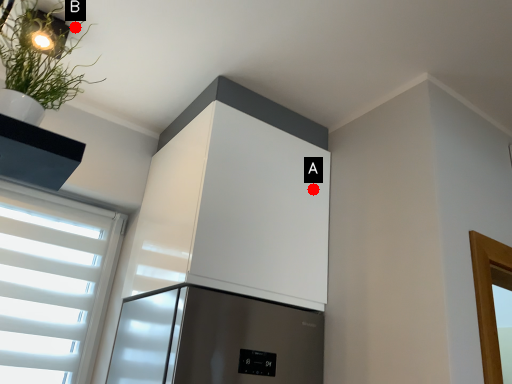
Question: Two points are circled on the image, labeled by A and B beside each circle. Which point is farther from the camera taking this photo?

Choices:
 (A) A is further
 (B) B is further

Answer: (A)